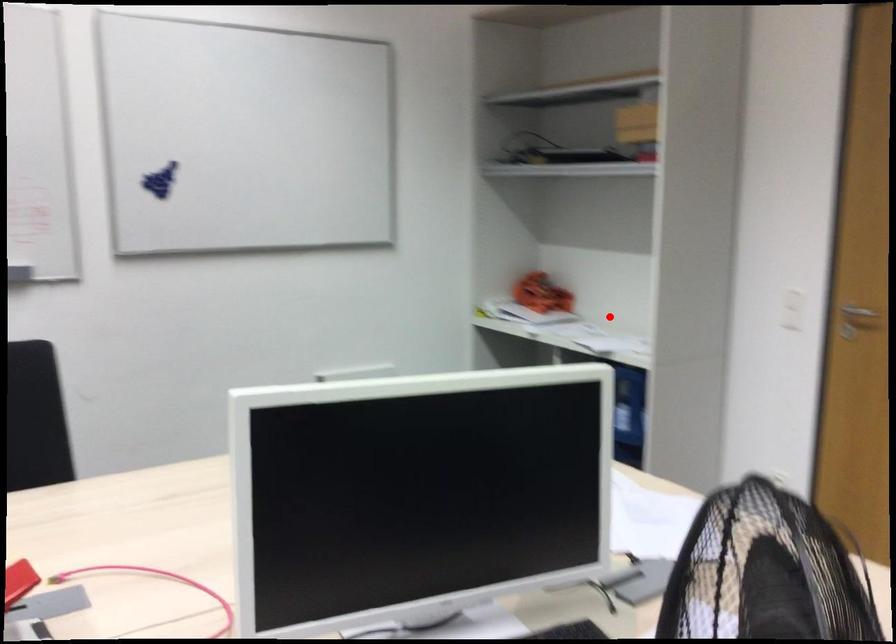
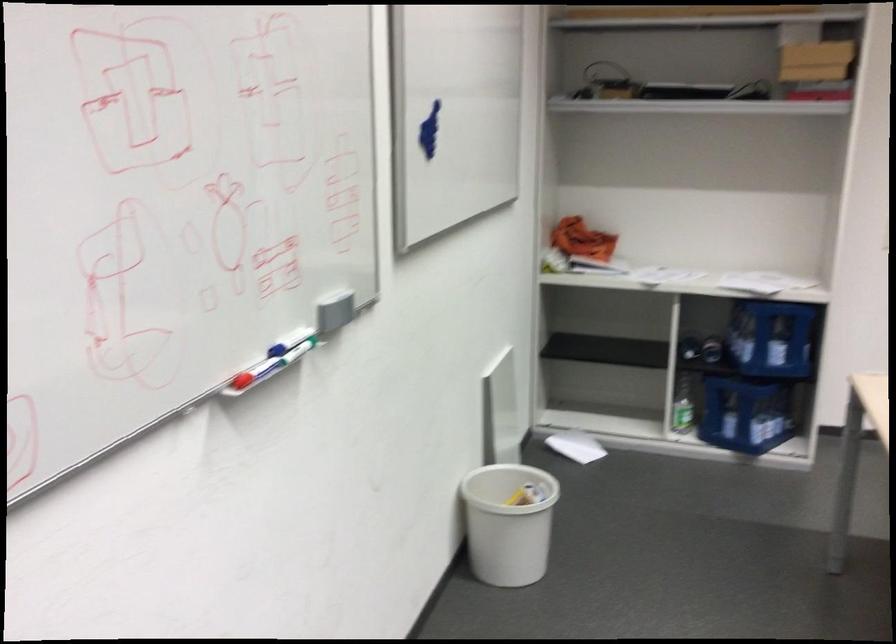
Find the pixel in the second image that matches the highlighted location in the first image.

(660, 275)